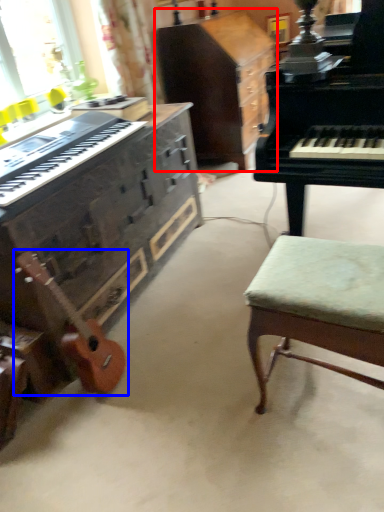
Question: Which object is closer to the camera taking this photo, cabinetry (highlighted by a red box) or guitar (highlighted by a blue box)?

Choices:
 (A) cabinetry
 (B) guitar

Answer: (B)